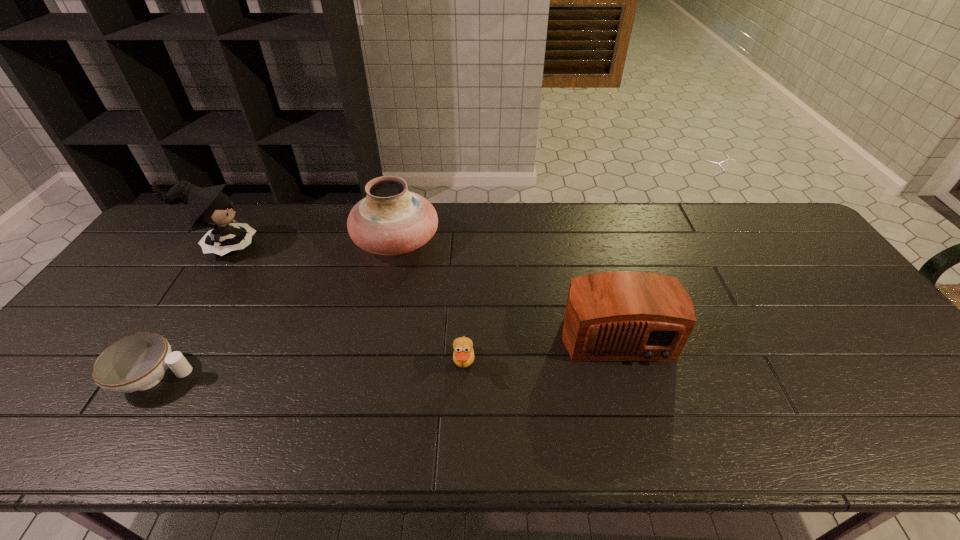
The height and width of the screenshot is (540, 960). Find the location of `vacant space that's between the pottery and the third tallest object`. vacant space that's between the pottery and the third tallest object is located at coordinates (506, 286).

Locate an element on the screen. The image size is (960, 540). object that stands as the closest to the doll is located at coordinates (390, 220).

The image size is (960, 540). In order to click on object that is the second closest to the shortest object in this screenshot , I will do `click(390, 220)`.

Locate an element on the screen. vacant space that satisfies the following two spatial constraints: 1. on the front-facing side of the rightmost object; 2. on the beak of the duck is located at coordinates (626, 367).

I want to click on vacant space that satisfies the following two spatial constraints: 1. on the front-facing side of the rightmost object; 2. on the side with the handle of the shortest object, so tap(629, 378).

Where is `vacant region that satisfies the following two spatial constraints: 1. on the front-facing side of the third tallest object; 2. on the beak of the second shortest object`? vacant region that satisfies the following two spatial constraints: 1. on the front-facing side of the third tallest object; 2. on the beak of the second shortest object is located at coordinates click(626, 367).